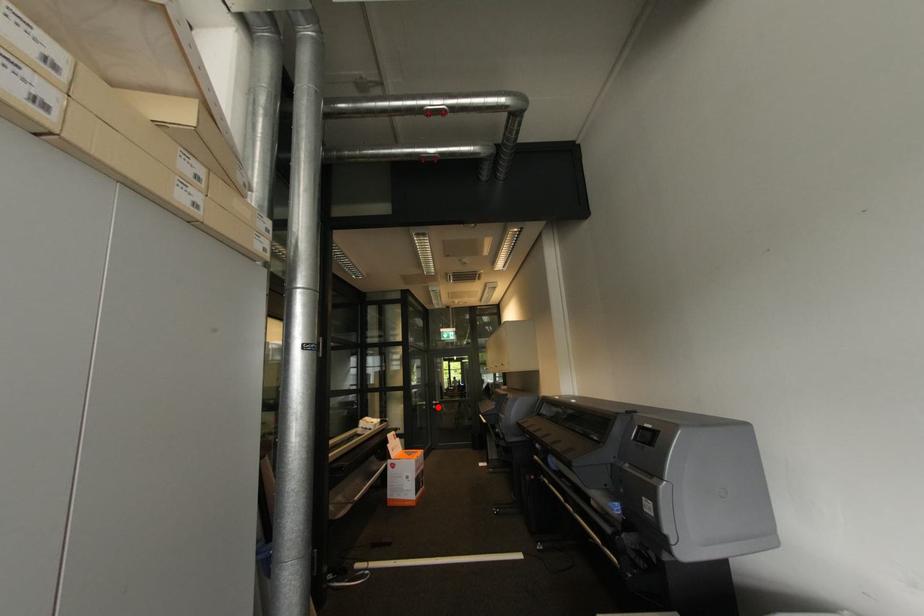
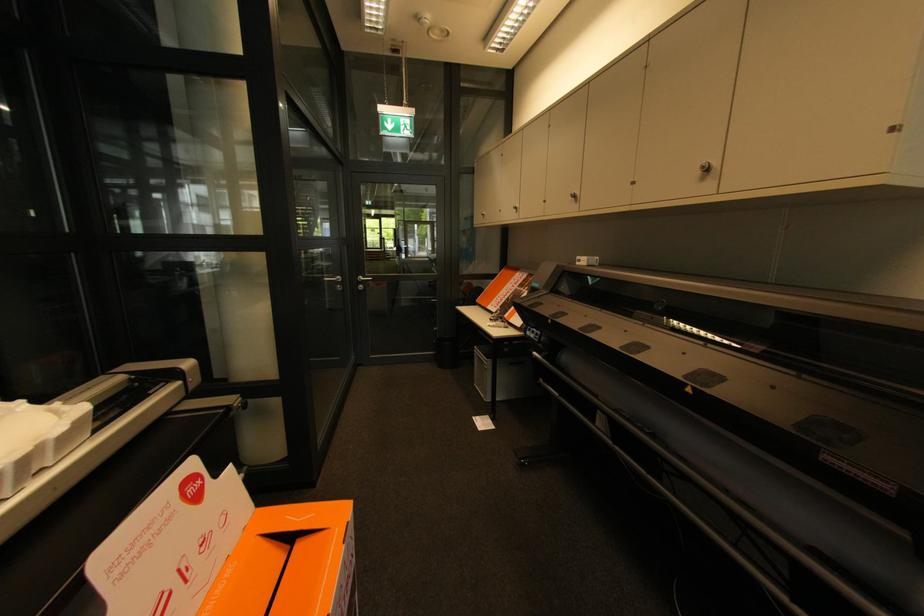
Question: I am providing you with two images of the same scene from different viewpoints. In image1, a red point is highlighted. Considering the same 3D point in image2, which of the following is correct?

Choices:
 (A) It is closer
 (B) It is farther

Answer: (A)